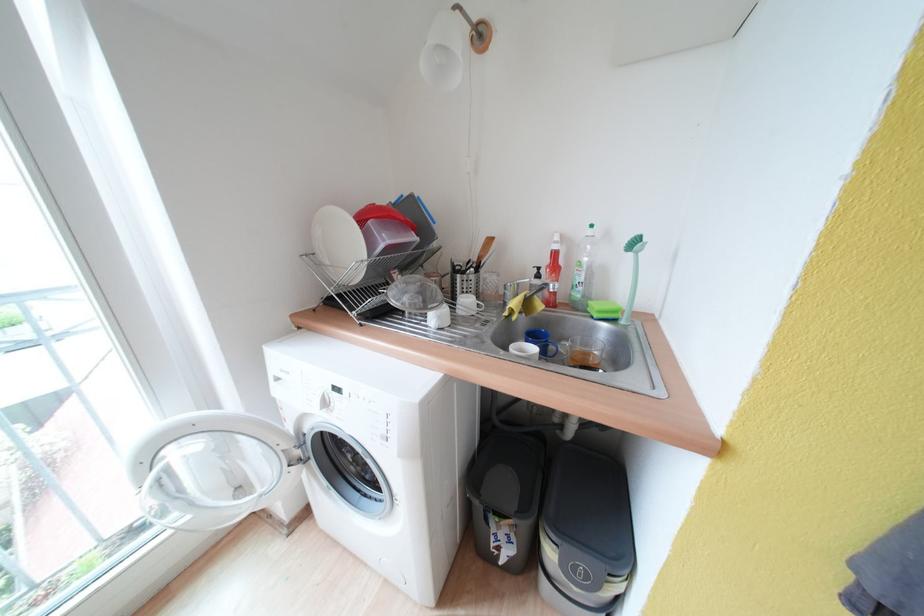
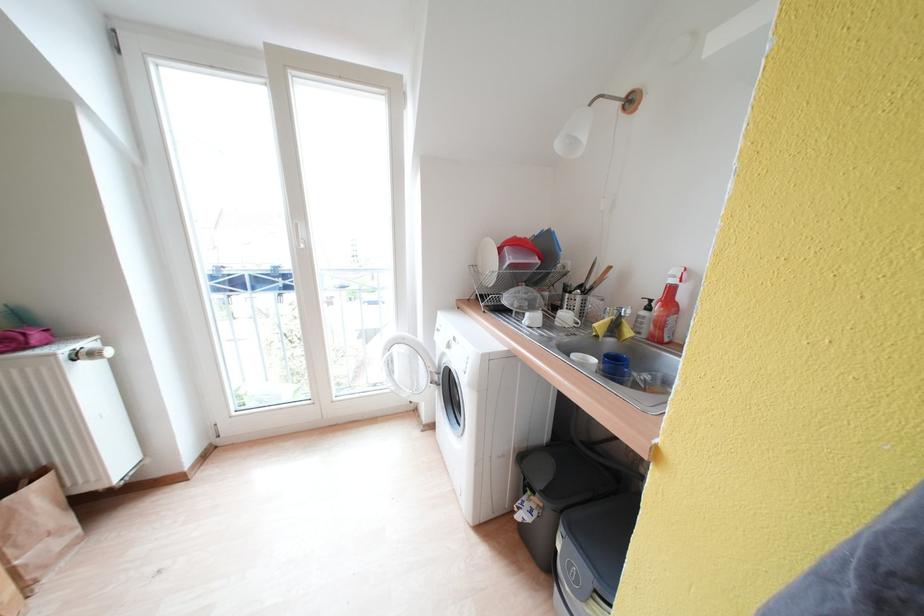
In the second image, find the point that corresponds to (566,265) in the first image.

(687, 302)